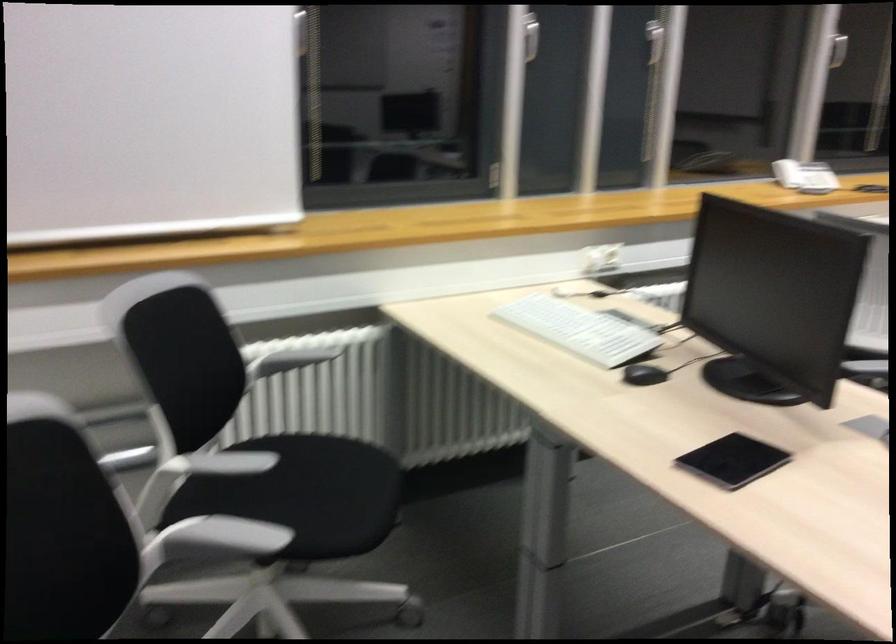
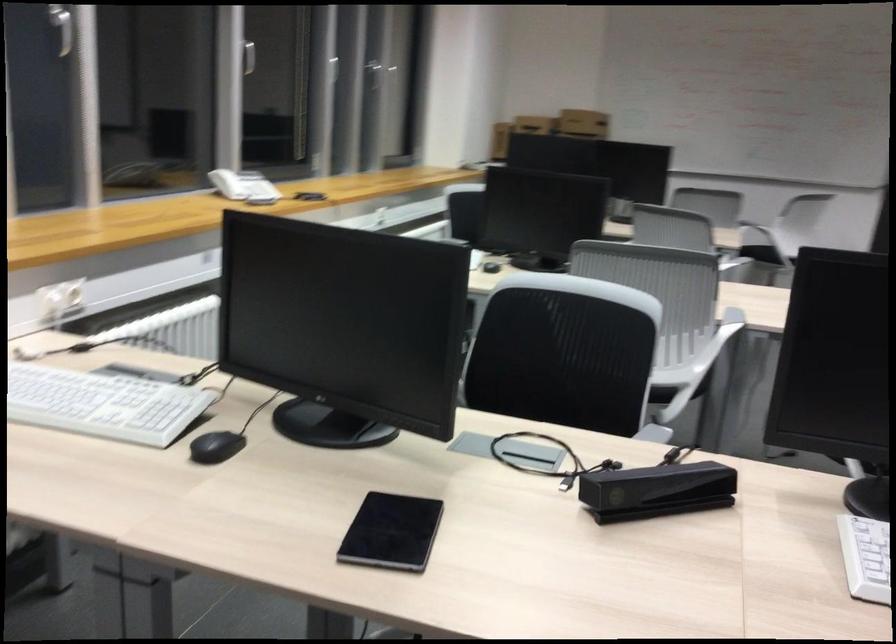
Where in the second image is the point corresponding to (x=791, y=160) from the first image?

(227, 184)